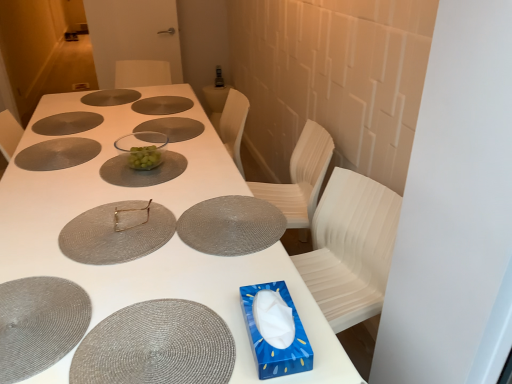
Question: Does transparent glass bowl at center, acting as the sixth glass plate starting from the back, have a lesser height compared to matte gray glass plate at upper center, which is the 9th glass plate from front to back?

Choices:
 (A) yes
 (B) no

Answer: (B)

Question: From a real-world perspective, does transparent glass bowl at center, which is the fourth glass plate from front to back, stand above matte gray glass plate at upper center, which is the 9th glass plate from front to back?

Choices:
 (A) yes
 (B) no

Answer: (A)

Question: Is transparent glass bowl at center, which is the fourth glass plate from front to back, surrounding matte gray glass plate at upper center, which is the 9th glass plate from front to back?

Choices:
 (A) yes
 (B) no

Answer: (B)

Question: Is transparent glass bowl at center, which is the fourth glass plate from front to back, to the right of matte gray glass plate at upper center, which ranks as the 1th glass plate in back-to-front order, from the viewer's perspective?

Choices:
 (A) yes
 (B) no

Answer: (A)

Question: Considering the relative sizes of transparent glass bowl at center, acting as the sixth glass plate starting from the back, and matte gray glass plate at upper center, which is the 9th glass plate from front to back, in the image provided, is transparent glass bowl at center, acting as the sixth glass plate starting from the back, thinner than matte gray glass plate at upper center, which is the 9th glass plate from front to back,?

Choices:
 (A) yes
 (B) no

Answer: (B)

Question: Based on their positions, is woven gray placemat at lower left located to the left or right of transparent glass bowl at center, the fourth glass plate viewed from the back?

Choices:
 (A) left
 (B) right

Answer: (A)

Question: Looking at the image, does woven gray placemat at lower left seem bigger or smaller compared to transparent glass bowl at center, the fourth glass plate viewed from the back?

Choices:
 (A) small
 (B) big

Answer: (B)

Question: Is woven gray placemat at lower left in front of or behind transparent glass bowl at center, the fourth glass plate viewed from the back, in the image?

Choices:
 (A) behind
 (B) front

Answer: (B)

Question: In terms of width, does woven gray placemat at lower left look wider or thinner when compared to transparent glass bowl at center, the fourth glass plate viewed from the back?

Choices:
 (A) thin
 (B) wide

Answer: (B)

Question: Is blue paper tissue box at lower right inside or outside of matte silver fork at center?

Choices:
 (A) outside
 (B) inside

Answer: (A)

Question: Is blue paper tissue box at lower right wider or thinner than matte silver fork at center?

Choices:
 (A) thin
 (B) wide

Answer: (B)

Question: Is point (270, 370) positioned closer to the camera than point (117, 211)?

Choices:
 (A) closer
 (B) farther

Answer: (A)

Question: Looking at the image, does blue paper tissue box at lower right seem bigger or smaller compared to matte silver fork at center?

Choices:
 (A) big
 (B) small

Answer: (A)

Question: Is point (121, 102) positioned closer to the camera than point (111, 142)?

Choices:
 (A) farther
 (B) closer

Answer: (A)

Question: Looking at the image, does matte gray glass plate at upper center, which ranks as the 1th glass plate in back-to-front order, seem bigger or smaller compared to white matte table at center?

Choices:
 (A) big
 (B) small

Answer: (B)